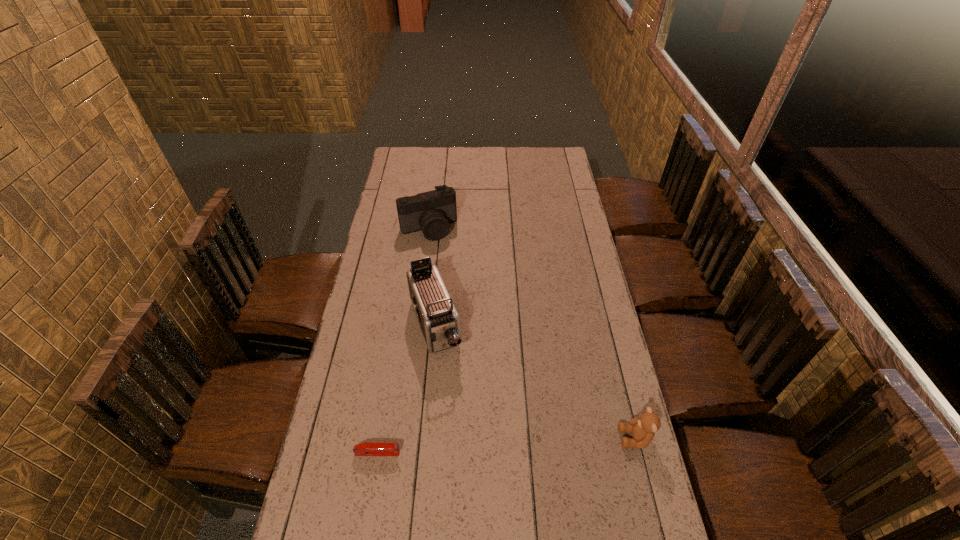
At what (x,y) coordinates should I click in order to perform the action: click on free location at the far edge of the desktop. Please return your answer as a coordinate pair (x, y). Looking at the image, I should click on (517, 164).

You are a GUI agent. You are given a task and a screenshot of the screen. Output one action in this format:
    pyautogui.click(x=<x>, y=<y>)
    Task: Click on the vacant space at the left edge
    
    Given the screenshot: What is the action you would take?
    pyautogui.click(x=407, y=186)

Where is `free region at the right edge of the desktop`? This screenshot has width=960, height=540. free region at the right edge of the desktop is located at coordinates (581, 221).

In order to click on vacant space at the far left corner of the desktop in this screenshot , I will do `click(417, 164)`.

Image resolution: width=960 pixels, height=540 pixels. What are the coordinates of `free space that is in between the farthest object and the rightmost object` in the screenshot? It's located at (532, 334).

Locate an element on the screen. unoccupied position between the rightmost object and the shortest object is located at coordinates (506, 446).

Where is `vacant area that lies between the shortest object and the tallest object`? vacant area that lies between the shortest object and the tallest object is located at coordinates (406, 389).

Where is `free space between the stapler and the teddy bear`? This screenshot has height=540, width=960. free space between the stapler and the teddy bear is located at coordinates (506, 446).

Identify the location of vacant area that lies between the stapler and the camcorder. (406, 389).

What are the coordinates of `vacant region between the camera and the rightmost object` in the screenshot? It's located at (532, 334).